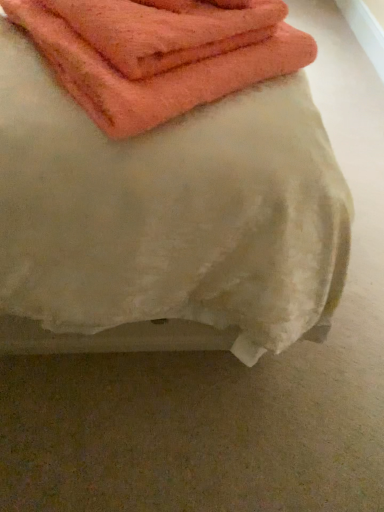
Question: Is orange terry cloth towel at upper left, the 2th towel from the back, oriented away from orange cotton towel at upper left, the third towel when ordered from back to front?

Choices:
 (A) no
 (B) yes

Answer: (B)

Question: Is orange terry cloth towel at upper left, the 2th towel from the back, to the left of orange cotton towel at upper left, the third towel when ordered from back to front, from the viewer's perspective?

Choices:
 (A) no
 (B) yes

Answer: (B)

Question: Is orange terry cloth towel at upper left, the 2th towel from the back, positioned behind orange cotton towel at upper left, which is the first towel in front-to-back order?

Choices:
 (A) yes
 (B) no

Answer: (A)

Question: From a real-world perspective, is orange terry cloth towel at upper left, marked as the 2th towel in a front-to-back arrangement, located beneath orange cotton towel at upper left, the third towel when ordered from back to front?

Choices:
 (A) no
 (B) yes

Answer: (A)

Question: Is orange terry cloth towel at upper left, the 2th towel from the back, closer to camera compared to orange cotton towel at upper left, the third towel when ordered from back to front?

Choices:
 (A) yes
 (B) no

Answer: (B)

Question: Does orange terry cloth towel at upper left, marked as the 2th towel in a front-to-back arrangement, have a greater height compared to orange cotton towel at upper left, which is the first towel in front-to-back order?

Choices:
 (A) no
 (B) yes

Answer: (A)

Question: Does orange terry cloth towel at upper left, the 2th towel from the back, have a greater height compared to orange terry cloth towel at upper left, the third towel from the front?

Choices:
 (A) yes
 (B) no

Answer: (A)

Question: Is orange terry cloth towel at upper left, the 2th towel from the back, facing away from orange terry cloth towel at upper left, acting as the 1th towel starting from the back?

Choices:
 (A) yes
 (B) no

Answer: (B)

Question: Is orange terry cloth towel at upper left, marked as the 2th towel in a front-to-back arrangement, shorter than orange terry cloth towel at upper left, the third towel from the front?

Choices:
 (A) no
 (B) yes

Answer: (A)

Question: Is orange terry cloth towel at upper left, marked as the 2th towel in a front-to-back arrangement, closer to camera compared to orange terry cloth towel at upper left, acting as the 1th towel starting from the back?

Choices:
 (A) no
 (B) yes

Answer: (B)

Question: Does orange terry cloth towel at upper left, the 2th towel from the back, appear on the right side of orange terry cloth towel at upper left, the third towel from the front?

Choices:
 (A) no
 (B) yes

Answer: (A)

Question: Can you confirm if orange terry cloth towel at upper left, the 2th towel from the back, is positioned to the left of orange terry cloth towel at upper left, acting as the 1th towel starting from the back?

Choices:
 (A) no
 (B) yes

Answer: (B)

Question: From a real-world perspective, is orange terry cloth towel at upper left, the third towel from the front, on orange cotton towel at upper left, the third towel when ordered from back to front?

Choices:
 (A) yes
 (B) no

Answer: (A)